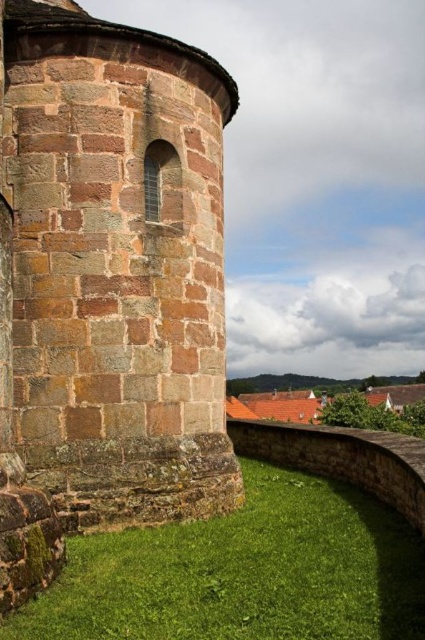
Question: Does brown stone tower at left have a smaller size compared to green grass at lower center?

Choices:
 (A) yes
 (B) no

Answer: (B)

Question: Where is brown stone tower at left located in relation to green grass at lower center in the image?

Choices:
 (A) right
 (B) left

Answer: (B)

Question: Does brown stone tower at left appear on the left side of green grass at lower center?

Choices:
 (A) no
 (B) yes

Answer: (B)

Question: Among these points, which one is nearest to the camera?

Choices:
 (A) (53, 570)
 (B) (71, 577)

Answer: (A)

Question: Which of the following is the farthest from the observer?

Choices:
 (A) tap(283, 605)
 (B) tap(96, 442)

Answer: (B)